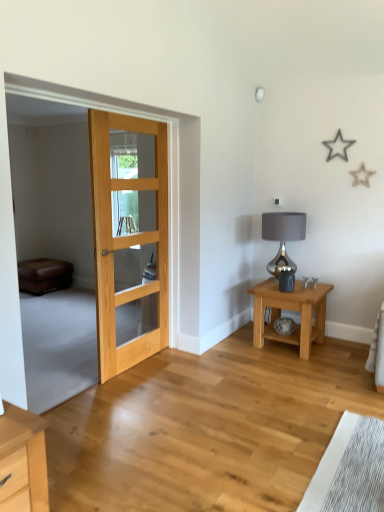
At what (x,y) coordinates should I click in order to perform the action: click on brown leather couch at left. Please return your answer as a coordinate pair (x, y). The width and height of the screenshot is (384, 512). Looking at the image, I should click on (44, 275).

What do you see at coordinates (283, 237) in the screenshot? I see `shiny metallic lamp at right` at bounding box center [283, 237].

Image resolution: width=384 pixels, height=512 pixels. Describe the element at coordinates (290, 310) in the screenshot. I see `light brown wood nightstand at lower right` at that location.

The image size is (384, 512). Identify the location of light brown wood nightstand at lower right. (290, 310).

Find the location of a particular element. This screenshot has width=384, height=512. brown leather couch at left is located at coordinates (44, 275).

Based on the photo, is shiny metallic lamp at right outside of light brown wood nightstand at lower right?

Yes, shiny metallic lamp at right is outside of light brown wood nightstand at lower right.

I want to click on nightstand located on the right of shiny metallic lamp at right, so click(x=290, y=310).

Is shiny metallic lamp at right taller than light brown wood nightstand at lower right?

Indeed, shiny metallic lamp at right has a greater height compared to light brown wood nightstand at lower right.

Is point (270, 267) closer or farther from the camera than point (286, 340)?

Clearly, point (270, 267) is more distant from the camera than point (286, 340).

From a real-world perspective, which object rests below the other?

brown leather couch at left is physically lower.

Considering the sizes of objects brown leather couch at left and natural wood door at left in the image provided, who is bigger, brown leather couch at left or natural wood door at left?

Bigger between the two is natural wood door at left.

Is brown leather couch at left far away from natural wood door at left?

Yes, brown leather couch at left is far from natural wood door at left.

Is brown leather couch at left oriented away from natural wood door at left?

brown leather couch at left does not have its back to natural wood door at left.

Is brown leather couch at left at the back of natural wood door at left?

No, natural wood door at left is not facing away from brown leather couch at left.

Relative to brown leather couch at left, is natural wood door at left in front or behind?

Clearly, natural wood door at left is in front of brown leather couch at left.

Are natural wood door at left and brown leather couch at left located far from each other?

Yes.

Which of these two, natural wood door at left or brown leather couch at left, is bigger?

natural wood door at left.

From the image's perspective, which is above, light brown wood nightstand at lower right or shiny metallic lamp at right?

shiny metallic lamp at right.

Would you consider light brown wood nightstand at lower right to be distant from shiny metallic lamp at right?

No, light brown wood nightstand at lower right is in close proximity to shiny metallic lamp at right.

Is light brown wood nightstand at lower right not inside shiny metallic lamp at right?

Yes, light brown wood nightstand at lower right is not within shiny metallic lamp at right.

Is light brown wood nightstand at lower right shorter than shiny metallic lamp at right?

Indeed, light brown wood nightstand at lower right has a lesser height compared to shiny metallic lamp at right.

Considering the relative sizes of shiny metallic lamp at right and brown leather couch at left in the image provided, is shiny metallic lamp at right wider than brown leather couch at left?

Incorrect, the width of shiny metallic lamp at right does not surpass that of brown leather couch at left.

From the image's perspective, which one is positioned lower, shiny metallic lamp at right or brown leather couch at left?

brown leather couch at left.

Can you confirm if shiny metallic lamp at right is taller than brown leather couch at left?

Yes.

Can you confirm if shiny metallic lamp at right is smaller than brown leather couch at left?

Yes.

From a real-world perspective, does shiny metallic lamp at right stand above natural wood door at left?

No.

From the image's perspective, is shiny metallic lamp at right below natural wood door at left?

Yes, from the image's perspective, shiny metallic lamp at right is below natural wood door at left.

Considering the positions of points (298, 238) and (157, 351), is point (298, 238) closer to camera compared to point (157, 351)?

No, it is not.

Can you confirm if shiny metallic lamp at right is bigger than natural wood door at left?

Actually, shiny metallic lamp at right might be smaller than natural wood door at left.

Which of these two, natural wood door at left or shiny metallic lamp at right, is thinner?

With smaller width is natural wood door at left.

Which is more to the right, natural wood door at left or shiny metallic lamp at right?

From the viewer's perspective, shiny metallic lamp at right appears more on the right side.

Would you say natural wood door at left is inside or outside shiny metallic lamp at right?

natural wood door at left lies outside shiny metallic lamp at right.

Does natural wood door at left have a lesser height compared to shiny metallic lamp at right?

In fact, natural wood door at left may be taller than shiny metallic lamp at right.

Locate an element on the screen. The width and height of the screenshot is (384, 512). table lamp on the left of the light brown wood nightstand at lower right is located at coordinates (283, 237).

The width and height of the screenshot is (384, 512). In the image, there is a natural wood door at left. In order to click on couch below it (from the image's perspective) in this screenshot , I will do `click(44, 275)`.

Considering their positions, is shiny metallic lamp at right positioned closer to natural wood door at left than light brown wood nightstand at lower right?

light brown wood nightstand at lower right.

Looking at this image, which object lies further to the anchor point light brown wood nightstand at lower right, brown leather couch at left or natural wood door at left?

brown leather couch at left is positioned further to the anchor light brown wood nightstand at lower right.

Consider the image. Considering their positions, is brown leather couch at left positioned further to natural wood door at left than shiny metallic lamp at right?

brown leather couch at left.

When comparing their distances from brown leather couch at left, does shiny metallic lamp at right or light brown wood nightstand at lower right seem further?

light brown wood nightstand at lower right.

Estimate the real-world distances between objects in this image. Which object is closer to shiny metallic lamp at right, light brown wood nightstand at lower right or brown leather couch at left?

Based on the image, light brown wood nightstand at lower right appears to be nearer to shiny metallic lamp at right.

Estimate the real-world distances between objects in this image. Which object is further from shiny metallic lamp at right, natural wood door at left or light brown wood nightstand at lower right?

The object further to shiny metallic lamp at right is natural wood door at left.

From the image, which object appears to be farther from shiny metallic lamp at right, light brown wood nightstand at lower right or natural wood door at left?

natural wood door at left is further to shiny metallic lamp at right.

Considering their positions, is natural wood door at left positioned closer to brown leather couch at left than shiny metallic lamp at right?

natural wood door at left is positioned closer to the anchor brown leather couch at left.

In order to click on door between brown leather couch at left and light brown wood nightstand at lower right in this screenshot , I will do `click(129, 238)`.

This screenshot has height=512, width=384. Find the location of `door situated between brown leather couch at left and shiny metallic lamp at right from left to right`. door situated between brown leather couch at left and shiny metallic lamp at right from left to right is located at coordinates (129, 238).

Locate an element on the screen. The image size is (384, 512). table lamp between natural wood door at left and light brown wood nightstand at lower right is located at coordinates (283, 237).

This screenshot has width=384, height=512. Find the location of `table lamp located between brown leather couch at left and light brown wood nightstand at lower right in the left-right direction`. table lamp located between brown leather couch at left and light brown wood nightstand at lower right in the left-right direction is located at coordinates (283, 237).